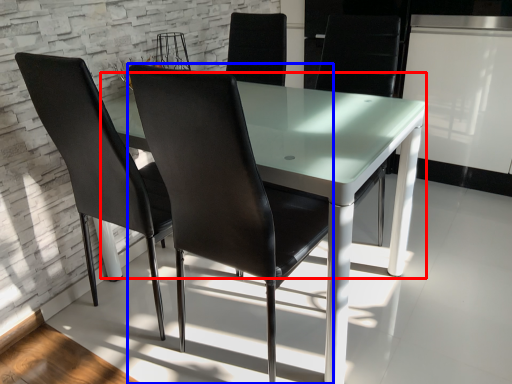
Question: Which object appears farthest to the camera in this image, round table (highlighted by a red box) or chair (highlighted by a blue box)?

Choices:
 (A) round table
 (B) chair

Answer: (A)